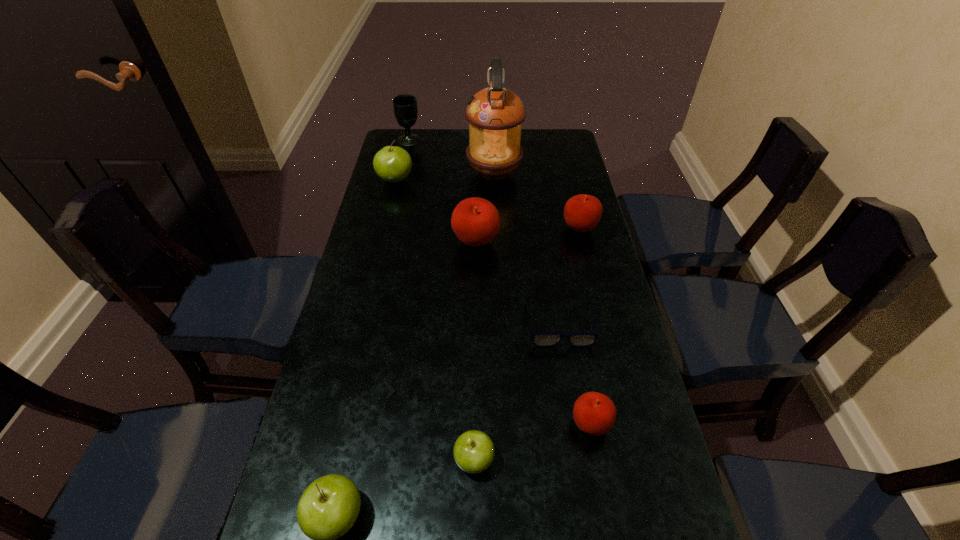
You are a GUI agent. You are given a task and a screenshot of the screen. Output one action in this format:
    pyautogui.click(x=<x>, y=<y>)
    Task: Click on the shortest object
    Image resolution: width=960 pixels, height=540 pixels.
    Given the screenshot: What is the action you would take?
    pyautogui.click(x=539, y=339)

Locate an element on the screen. vacant space located 0.060m on the back of the oil lamp is located at coordinates (493, 151).

You are a GUI agent. You are given a task and a screenshot of the screen. Output one action in this format:
    pyautogui.click(x=<x>, y=<y>)
    Task: Click on the free space located on the front of the chalice
    
    Given the screenshot: What is the action you would take?
    399,184

Where is `free space located 0.080m on the back of the farthest apple`? free space located 0.080m on the back of the farthest apple is located at coordinates (400, 159).

Locate an element on the screen. This screenshot has height=540, width=960. free location located on the back of the leftmost red apple is located at coordinates (476, 213).

You are a GUI agent. You are given a task and a screenshot of the screen. Output one action in this format:
    pyautogui.click(x=<x>, y=<y>)
    Task: Click on the free space located 0.250m on the front of the second biggest red apple
    This screenshot has height=540, width=960.
    Given the screenshot: What is the action you would take?
    pyautogui.click(x=597, y=301)

Identify the location of free location located on the back of the rightmost green apple. (475, 353).

The height and width of the screenshot is (540, 960). In order to click on free space located on the left of the nearest red apple in this screenshot , I will do `click(472, 424)`.

Identify the location of free space located 0.120m on the front-facing side of the shortest object. (571, 392).

Find the location of `oil lamp located at the far edge`. oil lamp located at the far edge is located at coordinates (495, 114).